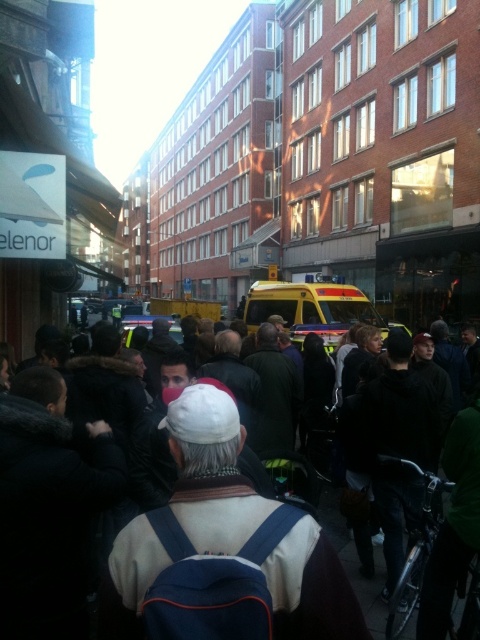
Is white knitted hat at center positioned behind yellow rubber taxi at center?

That is False.

Can you confirm if white knitted hat at center is taller than yellow rubber taxi at center?

No.

Is point (342, 598) farther from camera compared to point (336, 323)?

No.

You are a GUI agent. You are given a task and a screenshot of the screen. Output one action in this format:
    pyautogui.click(x=<x>, y=<y>)
    Task: Click on the white knitted hat at center
    
    Given the screenshot: What is the action you would take?
    pyautogui.click(x=212, y=472)

Can you confirm if black fabric crowd at center is wider than yellow rubber taxi at center?

No, black fabric crowd at center is not wider than yellow rubber taxi at center.

Is point (348, 609) in front of point (364, 301)?

Yes.

Where is `black fabric crowd at center`? Image resolution: width=480 pixels, height=640 pixels. black fabric crowd at center is located at coordinates (314, 589).

Is white knitted hat at center shorter than black fabric crowd at center?

Correct, white knitted hat at center is not as tall as black fabric crowd at center.

Who is positioned more to the left, white knitted hat at center or black fabric crowd at center?

white knitted hat at center

What do you see at coordinates (212, 472) in the screenshot?
I see `white knitted hat at center` at bounding box center [212, 472].

The width and height of the screenshot is (480, 640). In order to click on white knitted hat at center in this screenshot , I will do `click(212, 472)`.